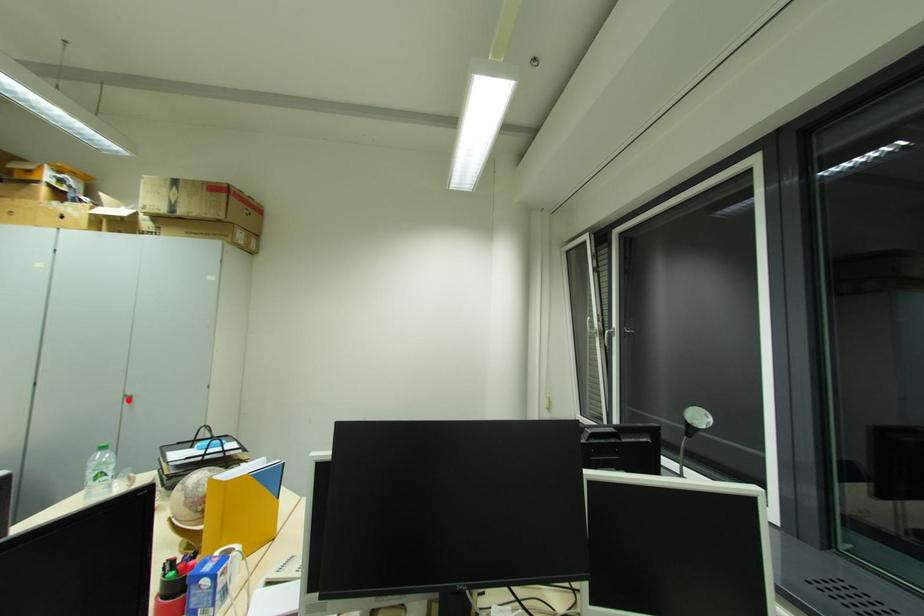
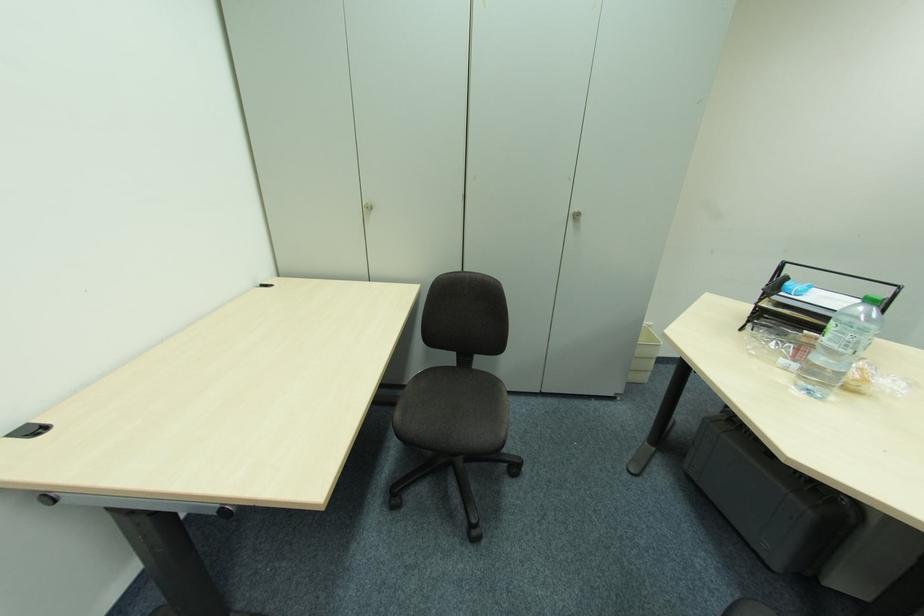
In the second image, find the point that corresponds to the highlighted location in the first image.

(574, 219)